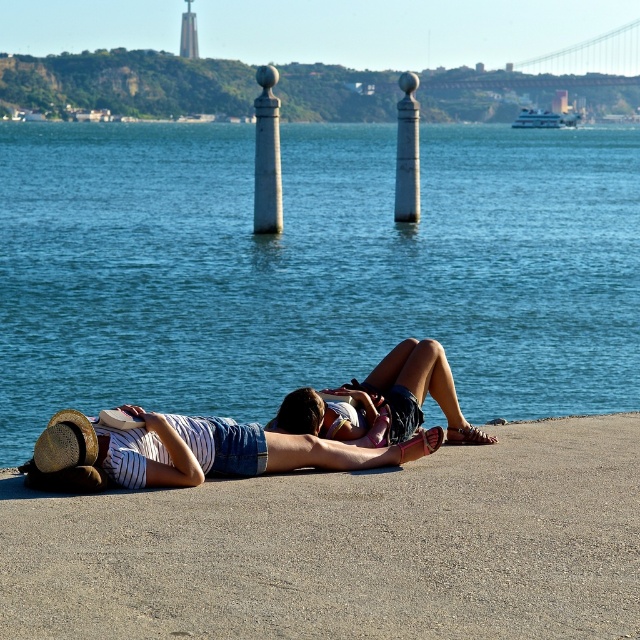
You are a maintenance worker needing to reach the smooth concrete dock at lower center from the denim shorts at center. Can you walk directly to it without any obstacles?

The distance between the smooth concrete dock at lower center and the denim shorts at center is 5.15 feet, so you can walk directly to it without any obstacles as the distance is manageable.

You are standing at the riverside and want to place a small picnic basket between the denim shorts at lower center and the white stone post at center. Which object should you place the basket closer to if you want it to be nearer to the viewer?

You should place the picnic basket closer to the denim shorts at lower center because it is nearer to the viewer compared to the white stone post at center.

You are a photographer standing at the riverside and want to take a photo of the denim shorts at lower center and the white stone post at center. Which object should you focus on first if you want to capture both in the same frame without moving the camera?

The denim shorts at lower center is below the white stone post at center, so you should focus on the white stone post at center first to ensure both objects are in the frame.